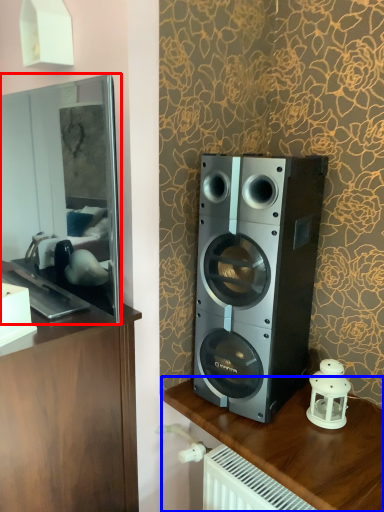
Question: Which of the following is the farthest to the observer, mirror (highlighted by a red box) or furniture (highlighted by a blue box)?

Choices:
 (A) mirror
 (B) furniture

Answer: (B)